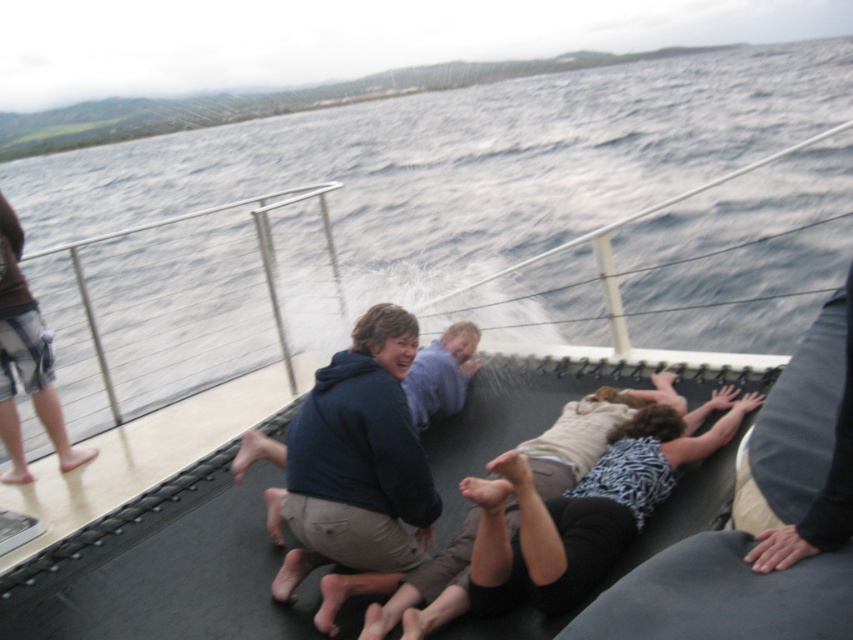
Between white textured shirt at center and light purple hoodie at center, which one is positioned lower?

white textured shirt at center is below.

Does white textured shirt at center have a greater height compared to light purple hoodie at center?

Yes, white textured shirt at center is taller than light purple hoodie at center.

The height and width of the screenshot is (640, 853). In order to click on white textured shirt at center in this screenshot , I will do `click(572, 515)`.

Can you confirm if white textured shirt at center is positioned to the left of brown denim shorts at left?

Incorrect, white textured shirt at center is not on the left side of brown denim shorts at left.

The image size is (853, 640). Describe the element at coordinates (572, 515) in the screenshot. I see `white textured shirt at center` at that location.

Identify the location of white textured shirt at center. The width and height of the screenshot is (853, 640). (572, 515).

Is point (1, 307) closer to camera compared to point (415, 365)?

Yes, point (1, 307) is closer to viewer.

Between point (38, 323) and point (469, 330), which one is positioned behind?

Positioned behind is point (469, 330).

Locate an element on the screen. The image size is (853, 640). brown denim shorts at left is located at coordinates (26, 358).